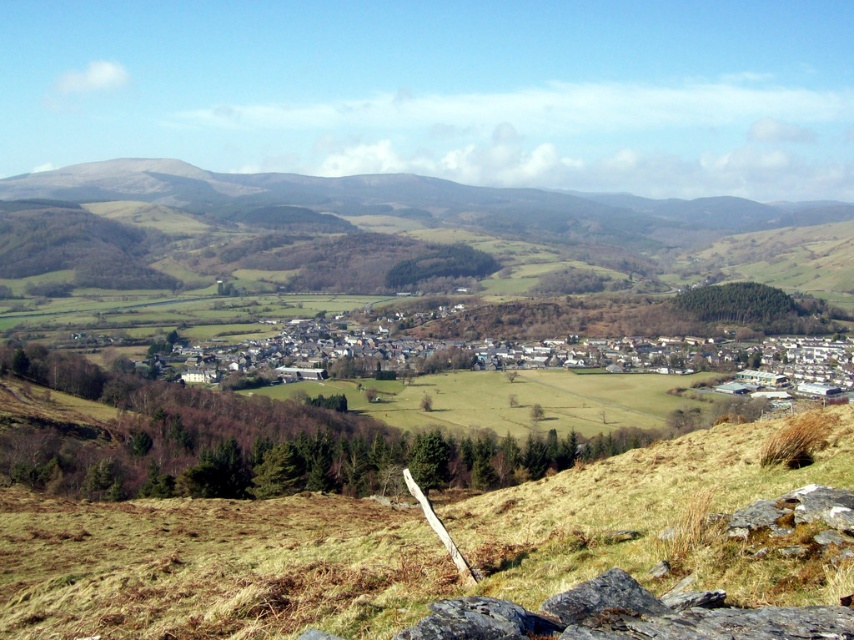
Question: Which of the following is the farthest from the observer?

Choices:
 (A) (492, 604)
 (B) (831, 577)

Answer: (B)

Question: Which of the following is the farthest from the observer?

Choices:
 (A) dark gray rough rock at lower center
 (B) green grassy hill at upper center
 (C) dark gray rock at lower right
 (D) brown dry grass at lower center

Answer: (B)

Question: Which point is farther to the camera?

Choices:
 (A) (623, 600)
 (B) (849, 236)
 (C) (695, 573)
 (D) (507, 621)

Answer: (B)

Question: Does green grassy hill at upper center appear on the left side of dark gray rock at lower right?

Choices:
 (A) yes
 (B) no

Answer: (A)

Question: Can you confirm if green grassy hill at upper center is bigger than dark gray rock at lower right?

Choices:
 (A) no
 (B) yes

Answer: (B)

Question: Considering the relative positions of brown dry grass at lower center and green grassy hill at upper center in the image provided, where is brown dry grass at lower center located with respect to green grassy hill at upper center?

Choices:
 (A) below
 (B) above

Answer: (A)